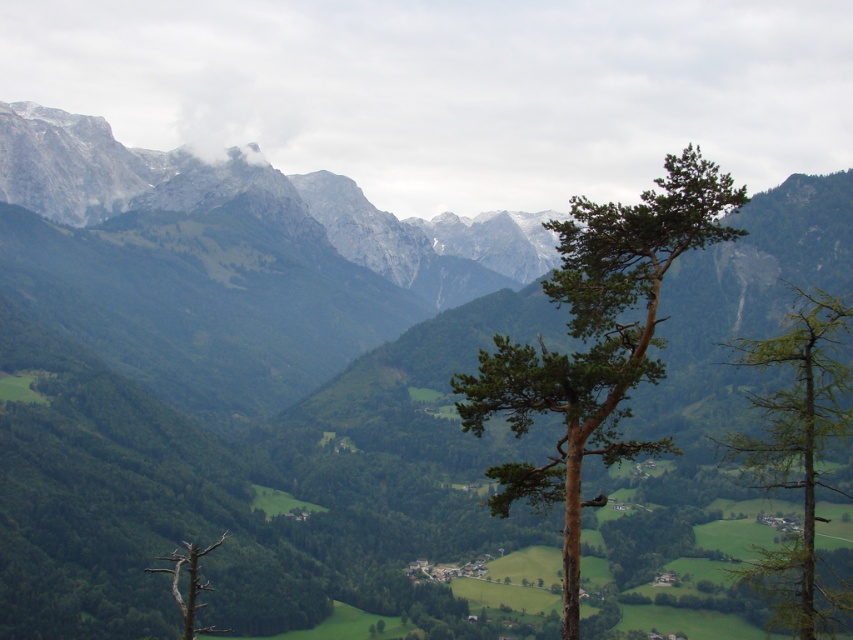
Question: Which point is farther to the camera?

Choices:
 (A) (194, 636)
 (B) (579, 486)
 (C) (782, 472)

Answer: (A)

Question: Which of the following is the closest to the observer?

Choices:
 (A) [775, 404]
 (B) [183, 595]
 (C) [624, 380]

Answer: (C)

Question: Does green lacy tree at right come behind brown deadwood at lower left?

Choices:
 (A) no
 (B) yes

Answer: (A)

Question: Is green rough bark tree at center thinner than brown deadwood at lower left?

Choices:
 (A) yes
 (B) no

Answer: (B)

Question: Which object is the closest to the green lacy tree at right?

Choices:
 (A) brown deadwood at lower left
 (B) green rough bark tree at center

Answer: (B)

Question: Can you confirm if green rough bark tree at center is positioned below green lacy tree at right?

Choices:
 (A) yes
 (B) no

Answer: (B)